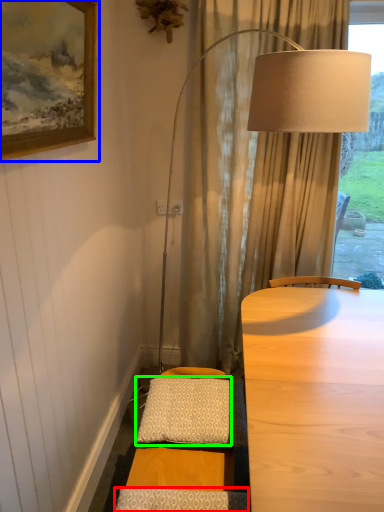
Question: Considering the real-world distances, which object is farthest from pillow (highlighted by a red box)? picture frame (highlighted by a blue box) or pillow (highlighted by a green box)?

Choices:
 (A) picture frame
 (B) pillow

Answer: (A)